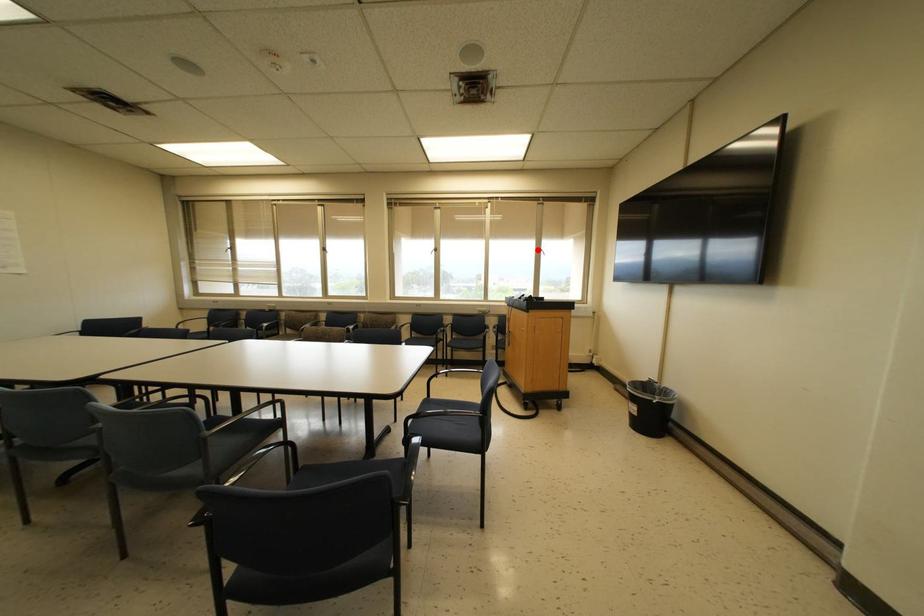
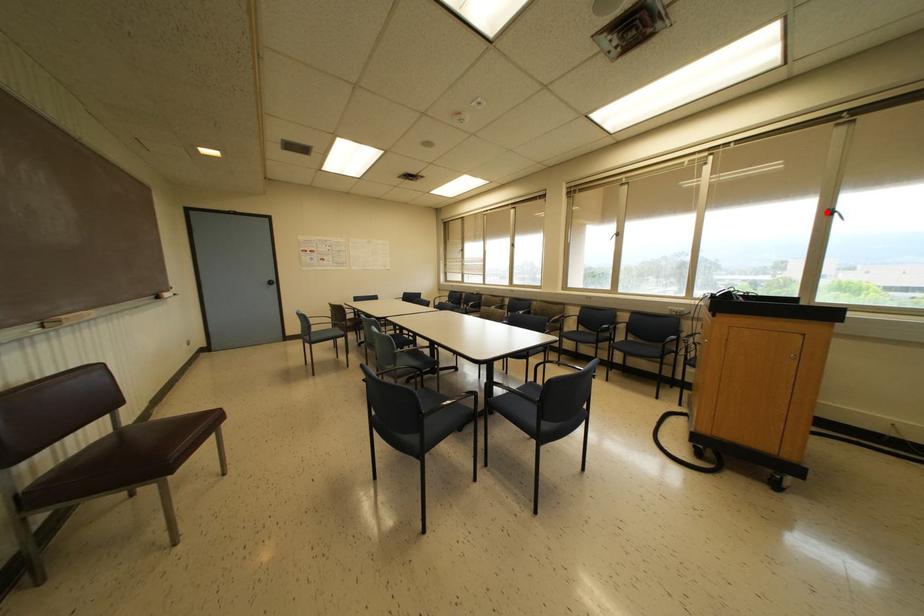
I am providing you with two images of the same scene from different viewpoints. A red point is marked on the first image and another point is marked on the second image. Are the points marked in image1 and image2 representing the same 3D position?

Yes